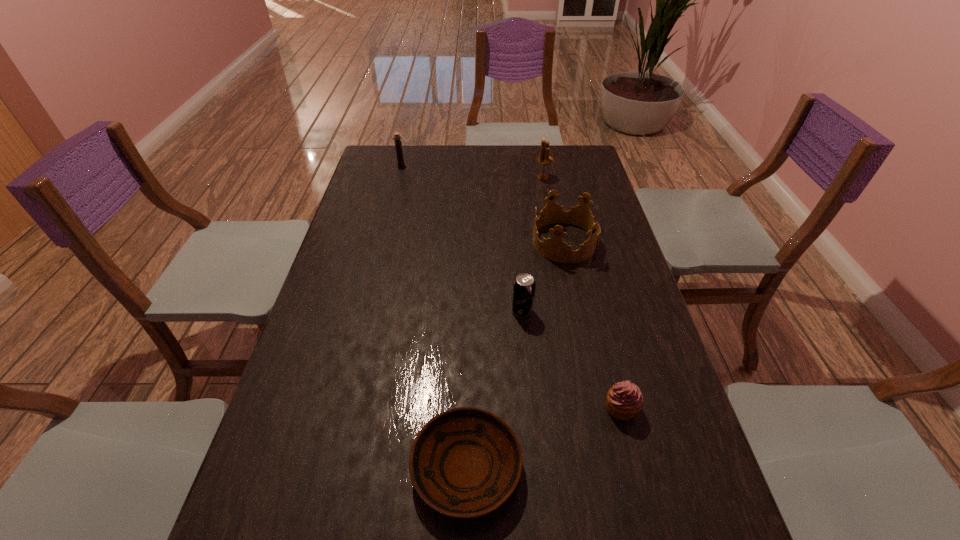
Where is `the second farthest object`? The height and width of the screenshot is (540, 960). the second farthest object is located at coordinates (544, 159).

The image size is (960, 540). Identify the location of the nearer candle holder. (544, 159).

Identify the location of the shorter candle holder. Image resolution: width=960 pixels, height=540 pixels. [x=398, y=144].

Where is `the farther candle holder`? The height and width of the screenshot is (540, 960). the farther candle holder is located at coordinates (398, 144).

Locate an element on the screen. The height and width of the screenshot is (540, 960). tiara is located at coordinates (554, 248).

Image resolution: width=960 pixels, height=540 pixels. I want to click on soda can, so click(x=524, y=286).

Identify the location of the third nearest object. The width and height of the screenshot is (960, 540). (524, 286).

Find the location of a particular element. cupcake is located at coordinates click(x=624, y=400).

This screenshot has width=960, height=540. Identify the location of plate. (465, 462).

At what (x,y) coordinates should I click in order to perform the action: click on the shortest object. Please return your answer as a coordinate pair (x, y). This screenshot has width=960, height=540. Looking at the image, I should click on (465, 462).